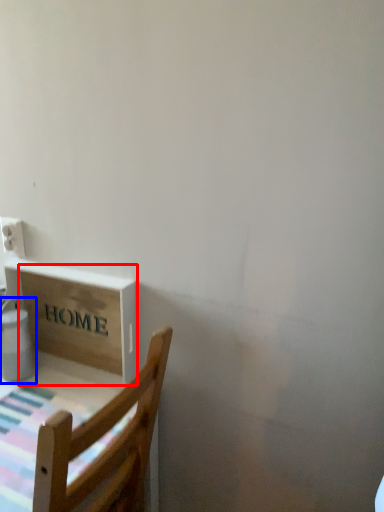
Question: Which object appears closest to the camera in this image, cardboard box (highlighted by a red box) or water heater (highlighted by a blue box)?

Choices:
 (A) cardboard box
 (B) water heater

Answer: (A)